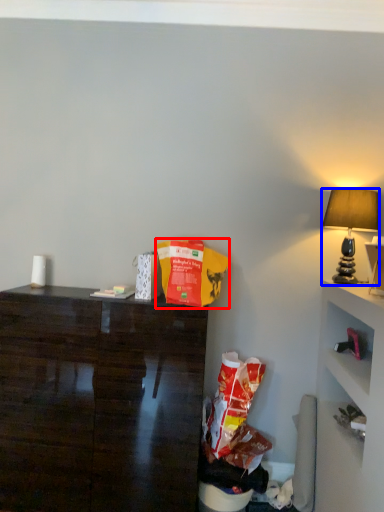
Question: Which point is closer to the camera, paper bag (highlighted by a red box) or lamp (highlighted by a blue box)?

Choices:
 (A) paper bag
 (B) lamp

Answer: (A)